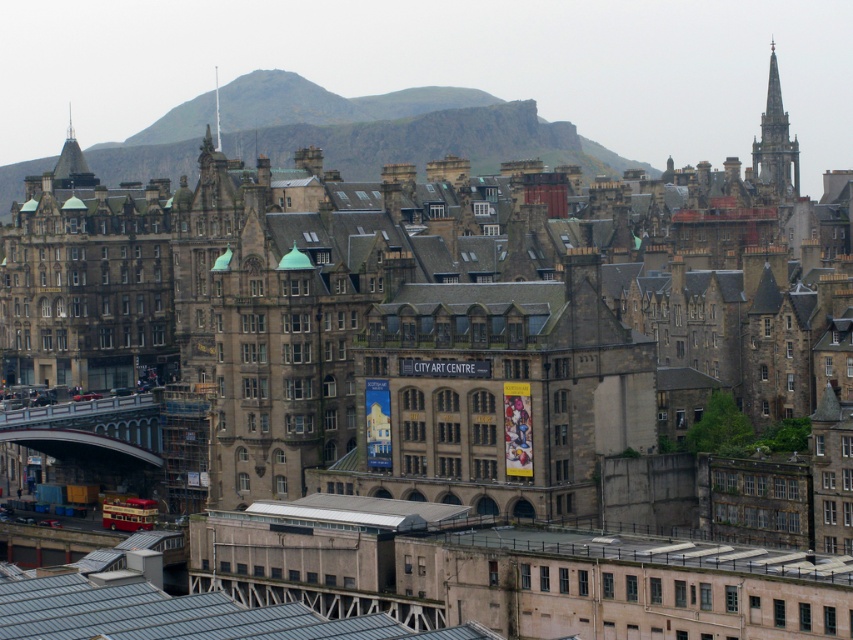
Which is above, stone spire at upper right or shiny gold spire at upper left?

shiny gold spire at upper left is above.

Who is taller, stone spire at upper right or shiny gold spire at upper left?

With more height is shiny gold spire at upper left.

Who is more distant from viewer, (x=775, y=124) or (x=71, y=141)?

Point (x=775, y=124)

The width and height of the screenshot is (853, 640). Find the location of `stone spire at upper right`. stone spire at upper right is located at coordinates (775, 141).

Between shiny gold spire at upper left and smooth stone spire at upper center, which one appears on the right side from the viewer's perspective?

smooth stone spire at upper center

Between shiny gold spire at upper left and smooth stone spire at upper center, which one is positioned higher?

smooth stone spire at upper center is above.

Does point (67, 141) lie in front of point (215, 77)?

Yes, it is in front of point (215, 77).

You are a GUI agent. You are given a task and a screenshot of the screen. Output one action in this format:
    pyautogui.click(x=<x>, y=<y>)
    Task: Click on the shiny gold spire at upper left
    The height and width of the screenshot is (640, 853).
    Given the screenshot: What is the action you would take?
    pyautogui.click(x=73, y=164)

Can you confirm if stone spire at upper right is thinner than smooth stone spire at upper center?

No, stone spire at upper right is not thinner than smooth stone spire at upper center.

Who is positioned more to the right, stone spire at upper right or smooth stone spire at upper center?

From the viewer's perspective, stone spire at upper right appears more on the right side.

Does point (770, 81) lie in front of point (215, 70)?

Yes, point (770, 81) is closer to viewer.

Locate an element on the screen. stone spire at upper right is located at coordinates (775, 141).